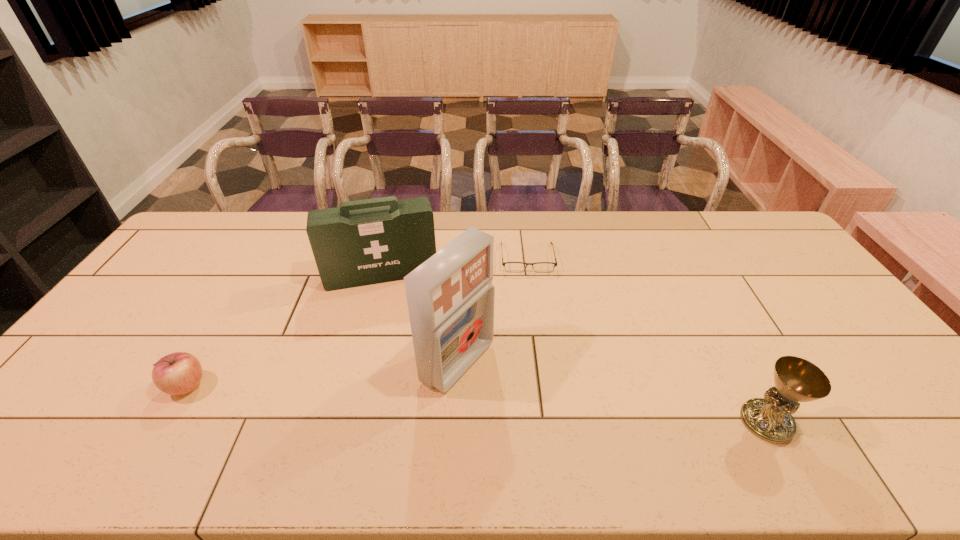
Identify the location of vacant region between the spectacles and the leftmost object. (357, 322).

This screenshot has width=960, height=540. What are the coordinates of `empty location between the leftmost object and the rightmost object` in the screenshot? It's located at point(477,404).

Locate an element on the screen. This screenshot has height=540, width=960. unoccupied position between the third tallest object and the nearer first-aid kit is located at coordinates (612, 392).

In order to click on empty space between the leftmost object and the rightmost object in this screenshot , I will do (477, 404).

Locate an element on the screen. This screenshot has height=540, width=960. blank region between the third shortest object and the second tallest object is located at coordinates (574, 348).

I want to click on free space between the rightmost object and the leftmost object, so click(477, 404).

Find the location of `object that is the third nearest to the rightmost object`. object that is the third nearest to the rightmost object is located at coordinates (364, 242).

At what (x,y) coordinates should I click in order to perform the action: click on object identified as the second closest to the fourth object from left to right. Please return your answer as a coordinate pair (x, y). The height and width of the screenshot is (540, 960). Looking at the image, I should click on (450, 296).

At what (x,y) coordinates should I click in order to perform the action: click on blank area in the image that satisfies the following two spatial constraints: 1. on the back side of the nearer first-aid kit; 2. on the left side of the spectacles. Please return your answer as a coordinate pair (x, y). Looking at the image, I should click on (463, 258).

Where is `free region that satisfies the following two spatial constraints: 1. on the front side of the nearer first-aid kit; 2. on the left side of the farther first-aid kit`? free region that satisfies the following two spatial constraints: 1. on the front side of the nearer first-aid kit; 2. on the left side of the farther first-aid kit is located at coordinates (359, 362).